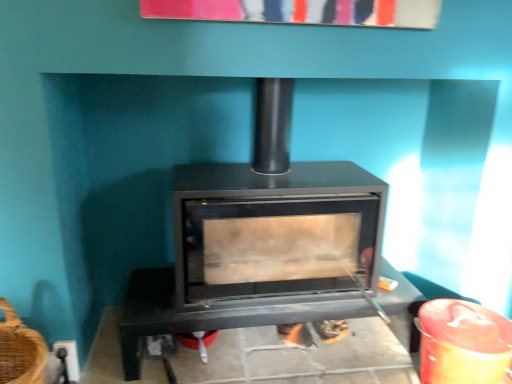
In order to face black matte fireplace at center, should I rotate leftwards or rightwards?

Turn right by 3.128 degrees to look at black matte fireplace at center.

Describe the element at coordinates (168, 315) in the screenshot. I see `black matte fireplace at center` at that location.

You are a GUI agent. You are given a task and a screenshot of the screen. Output one action in this format:
    pyautogui.click(x=<x>, y=<y>)
    Task: Click on the black matte fireplace at center
    
    Given the screenshot: What is the action you would take?
    pyautogui.click(x=168, y=315)

Identify the location of black matte wood burning stove at center. Image resolution: width=512 pixels, height=384 pixels. (264, 242).

What do you see at coordinates (264, 242) in the screenshot?
I see `black matte wood burning stove at center` at bounding box center [264, 242].

Find the location of a particular element. Image resolution: width=512 pixels, height=384 pixels. black matte fireplace at center is located at coordinates (168, 315).

Which is more to the right, black matte fireplace at center or black matte wood burning stove at center?

Positioned to the right is black matte fireplace at center.

Is black matte fireplace at center positioned before black matte wood burning stove at center?

No, it is not.

Considering the points (409, 332) and (265, 175), which point is in front, point (409, 332) or point (265, 175)?

The point (265, 175) is in front.

From the image's perspective, which one is positioned higher, black matte fireplace at center or black matte wood burning stove at center?

From the image's view, black matte wood burning stove at center is above.

From a real-world perspective, is black matte fireplace at center above or below black matte wood burning stove at center?

black matte fireplace at center is below black matte wood burning stove at center.

Considering the relative sizes of black matte fireplace at center and black matte wood burning stove at center in the image provided, is black matte fireplace at center wider than black matte wood burning stove at center?

Indeed, black matte fireplace at center has a greater width compared to black matte wood burning stove at center.

Considering the sizes of objects black matte fireplace at center and black matte wood burning stove at center in the image provided, who is taller, black matte fireplace at center or black matte wood burning stove at center?

Answer: black matte wood burning stove at center is taller.

Which of these two, black matte fireplace at center or black matte wood burning stove at center, is bigger?

With larger size is black matte wood burning stove at center.

Is black matte wood burning stove at center surrounded by black matte fireplace at center?

No, black matte fireplace at center does not contain black matte wood burning stove at center.

Is black matte fireplace at center far away from black matte wood burning stove at center?

That's not correct — black matte fireplace at center is a little close to black matte wood burning stove at center.

Is black matte fireplace at center facing away from black matte wood burning stove at center?

Yes, black matte fireplace at center is positioned with its back facing black matte wood burning stove at center.

At what (x,y) coordinates should I click in order to perform the action: click on furniture on the right of black matte wood burning stove at center. Please return your answer as a coordinate pair (x, y). The image size is (512, 384). Looking at the image, I should click on (168, 315).

Which is more to the right, black matte wood burning stove at center or black matte fireplace at center?

Positioned to the right is black matte fireplace at center.

In the scene shown: Which is in front, black matte wood burning stove at center or black matte fireplace at center?

black matte wood burning stove at center is closer to the camera.

Which is farther, (285, 157) or (134, 332)?

Point (285, 157)

From the image's perspective, is black matte wood burning stove at center over black matte fireplace at center?

Indeed, from the image's perspective, black matte wood burning stove at center is shown above black matte fireplace at center.

From the picture: From a real-world perspective, which object stands above the other?

black matte wood burning stove at center, from a real-world perspective.

In terms of width, does black matte wood burning stove at center look wider or thinner when compared to black matte fireplace at center?

Clearly, black matte wood burning stove at center has less width compared to black matte fireplace at center.

Is black matte wood burning stove at center taller or shorter than black matte fireplace at center?

A: Considering their sizes, black matte wood burning stove at center has more height than black matte fireplace at center.

Looking at the image, does black matte wood burning stove at center seem bigger or smaller compared to black matte fireplace at center?

In the image, black matte wood burning stove at center appears to be larger than black matte fireplace at center.

Is black matte wood burning stove at center inside or outside of black matte fireplace at center?

black matte wood burning stove at center is not enclosed by black matte fireplace at center.

Is black matte wood burning stove at center far from black matte fireplace at center?

Actually, black matte wood burning stove at center and black matte fireplace at center are a little close together.

Is black matte wood burning stove at center aimed at black matte fireplace at center?

No, black matte wood burning stove at center does not turn towards black matte fireplace at center.

Identify the location of wood burning stove in front of the black matte fireplace at center. (264, 242).

Locate an element on the screen. furniture beneath the black matte wood burning stove at center (from a real-world perspective) is located at coordinates (168, 315).

This screenshot has height=384, width=512. In the image, there is a black matte fireplace at center. Find the location of `wood burning stove above it (from the image's perspective)`. wood burning stove above it (from the image's perspective) is located at coordinates (264, 242).